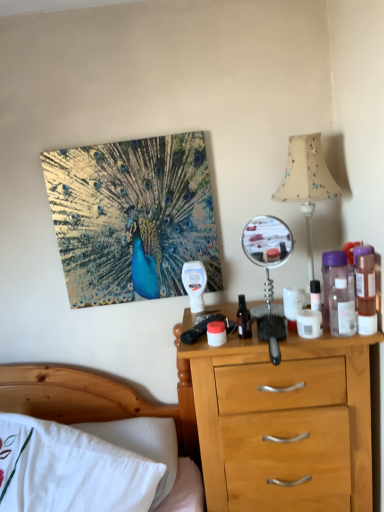
Question: Is white cotton bed at lower left surrounding purple translucent bottle at right, the 3th bottle from the right?

Choices:
 (A) yes
 (B) no

Answer: (B)

Question: Does white cotton bed at lower left turn towards purple translucent bottle at right, the 3th bottle from the right?

Choices:
 (A) yes
 (B) no

Answer: (B)

Question: Is white cotton bed at lower left not inside purple translucent bottle at right, the 3th bottle from the right?

Choices:
 (A) yes
 (B) no

Answer: (A)

Question: Is white cotton bed at lower left wider than purple translucent bottle at right, which ranks as the second bottle in left-to-right order?

Choices:
 (A) no
 (B) yes

Answer: (B)

Question: Can you confirm if white cotton bed at lower left is shorter than purple translucent bottle at right, which ranks as the second bottle in left-to-right order?

Choices:
 (A) no
 (B) yes

Answer: (A)

Question: Is white cotton bed at lower left positioned behind purple translucent bottle at right, the 3th bottle from the right?

Choices:
 (A) yes
 (B) no

Answer: (B)

Question: From a real-world perspective, is white matte jar at center physically below translucent plastic bottle at right, which is the 4th bottle in left-to-right order?

Choices:
 (A) yes
 (B) no

Answer: (A)

Question: Can you confirm if white matte jar at center is positioned to the left of translucent plastic bottle at right, which is the 4th bottle in left-to-right order?

Choices:
 (A) no
 (B) yes

Answer: (B)

Question: Is translucent plastic bottle at right, the 1th bottle when ordered from right to left, located within white matte jar at center?

Choices:
 (A) yes
 (B) no

Answer: (B)

Question: Considering the relative positions of white matte jar at center and translucent plastic bottle at right, which is the 4th bottle in left-to-right order, in the image provided, is white matte jar at center in front of translucent plastic bottle at right, which is the 4th bottle in left-to-right order,?

Choices:
 (A) no
 (B) yes

Answer: (A)

Question: Is white matte jar at center shorter than translucent plastic bottle at right, which is the 4th bottle in left-to-right order?

Choices:
 (A) yes
 (B) no

Answer: (A)

Question: From the image's perspective, does white matte jar at center appear lower than translucent plastic bottle at right, the 1th bottle when ordered from right to left?

Choices:
 (A) no
 (B) yes

Answer: (B)

Question: Is the position of shiny metallic peacock at upper left more distant than that of white cotton bed at lower left?

Choices:
 (A) yes
 (B) no

Answer: (A)